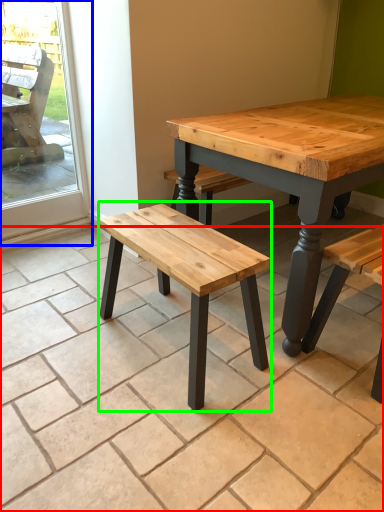
Question: Which is nearer to the tile (highlighted by a red box)? screen door (highlighted by a blue box) or stool (highlighted by a green box).

Choices:
 (A) screen door
 (B) stool

Answer: (B)